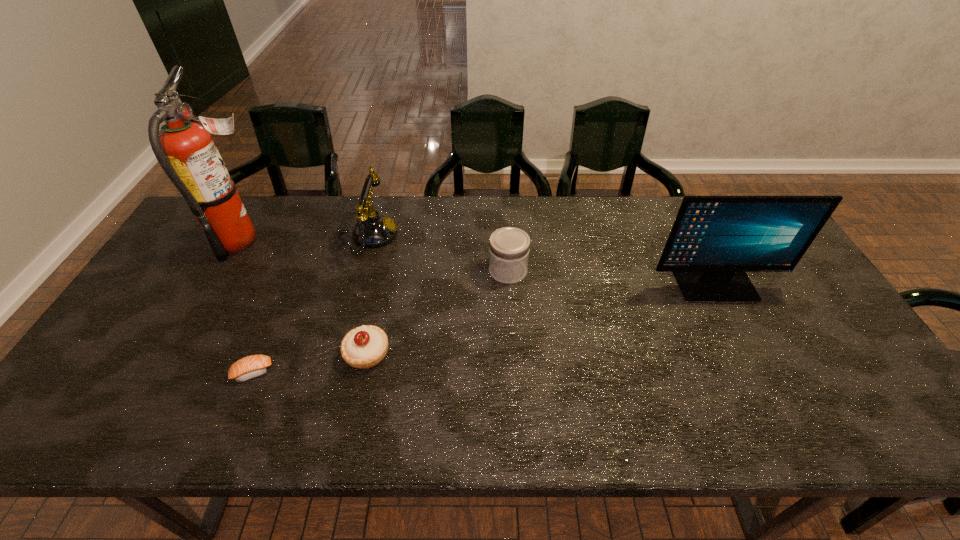
You are a GUI agent. You are given a task and a screenshot of the screen. Output one action in this format:
    pyautogui.click(x=<x>, y=<y>)
    Task: Click on the free space between the second shortest object and the fourth tallest object
    The height and width of the screenshot is (540, 960).
    Given the screenshot: What is the action you would take?
    pyautogui.click(x=438, y=312)

You are a GUI agent. You are given a task and a screenshot of the screen. Output one action in this format:
    pyautogui.click(x=<x>, y=<y>)
    Task: Click on the empty space that is in between the shortest object and the jar
    Image resolution: width=960 pixels, height=540 pixels.
    Given the screenshot: What is the action you would take?
    pyautogui.click(x=380, y=321)

Where is `free area in between the jar and the telephone`? This screenshot has height=540, width=960. free area in between the jar and the telephone is located at coordinates (439, 253).

You are a GUI agent. You are given a task and a screenshot of the screen. Output one action in this format:
    pyautogui.click(x=<x>, y=<y>)
    Task: Click on the free space between the fifth object from left to right and the second shortest object
    This screenshot has width=960, height=540.
    Given the screenshot: What is the action you would take?
    pyautogui.click(x=438, y=312)

Image resolution: width=960 pixels, height=540 pixels. Find the location of `free spot between the third tallest object and the second object from right to left`. free spot between the third tallest object and the second object from right to left is located at coordinates 439,253.

Identify the location of object that can be found as the closest to the pastry. This screenshot has width=960, height=540. (250, 367).

Image resolution: width=960 pixels, height=540 pixels. Find the location of `the third closest object to the monitor`. the third closest object to the monitor is located at coordinates (372, 230).

Where is `free space that satisfies the following two spatial constraints: 1. on the back side of the pastry; 2. from the nozzle of the fire extinguisher`? free space that satisfies the following two spatial constraints: 1. on the back side of the pastry; 2. from the nozzle of the fire extinguisher is located at coordinates (392, 240).

At what (x,y) coordinates should I click in order to perform the action: click on free region that satisfies the following two spatial constraints: 1. on the back side of the fifth tallest object; 2. from the nozzle of the leftmost object. Please return your answer as a coordinate pair (x, y). Image resolution: width=960 pixels, height=540 pixels. Looking at the image, I should click on (392, 240).

This screenshot has width=960, height=540. Find the location of `vacant space that satisfies the following two spatial constraints: 1. on the dial of the pastry; 2. on the left side of the telephone`. vacant space that satisfies the following two spatial constraints: 1. on the dial of the pastry; 2. on the left side of the telephone is located at coordinates (338, 354).